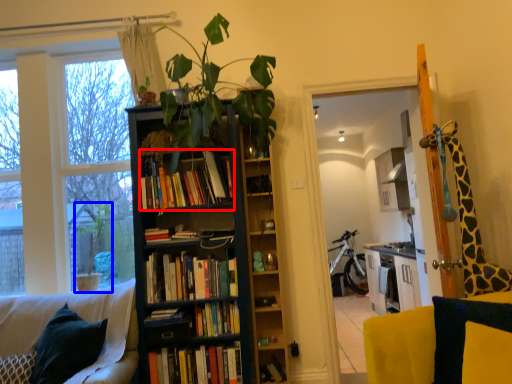
Question: Which point is further to the camera, book (highlighted by a red box) or houseplant (highlighted by a blue box)?

Choices:
 (A) book
 (B) houseplant

Answer: (B)